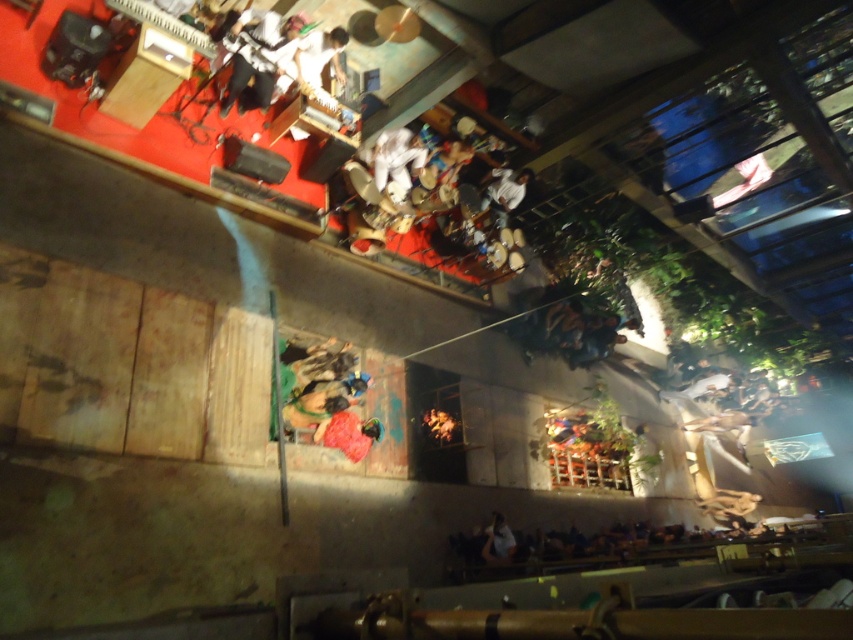
Question: Estimate the real-world distances between objects in this image. Which object is farther from the white fabric shirt at lower center?

Choices:
 (A) velvet red dress at center
 (B) white fabric guitar at upper center

Answer: (B)

Question: Among these objects, which one is farthest from the camera?

Choices:
 (A) white fabric guitar at upper center
 (B) smooth brown leather jacket at lower right
 (C) white cotton pants at center

Answer: (B)

Question: Considering the relative positions of velvet red dress at center and white fabric shirt at lower center in the image provided, where is velvet red dress at center located with respect to white fabric shirt at lower center?

Choices:
 (A) left
 (B) right

Answer: (A)

Question: Which point is closer to the camera taking this photo?

Choices:
 (A) (310, 54)
 (B) (352, 420)
 (C) (498, 532)

Answer: (B)

Question: Is white fabric guitar at upper center wider than wooden drum at upper center?

Choices:
 (A) yes
 (B) no

Answer: (A)

Question: Can you confirm if wooden drum at upper center is bigger than smooth brown leather jacket at lower right?

Choices:
 (A) yes
 (B) no

Answer: (B)